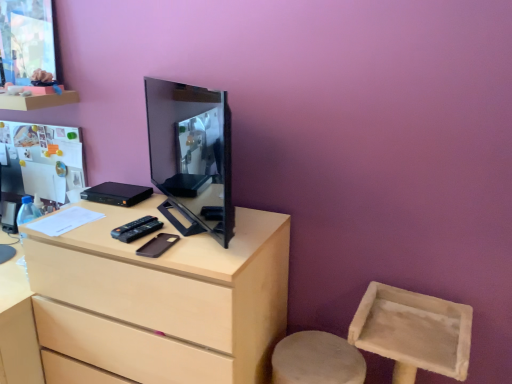
Find the location of `light wood chest of drawers at center`. light wood chest of drawers at center is located at coordinates [161, 300].

The height and width of the screenshot is (384, 512). In order to click on light wood chest of drawers at center in this screenshot , I will do `click(161, 300)`.

From the image's perspective, is matte wood shelf at upper left under light wood chest of drawers at center?

No.

Considering the relative sizes of matte wood shelf at upper left and light wood chest of drawers at center in the image provided, is matte wood shelf at upper left wider than light wood chest of drawers at center?

No.

Measure the distance between matte wood shelf at upper left and light wood chest of drawers at center.

matte wood shelf at upper left is 38.60 inches from light wood chest of drawers at center.

Can you confirm if matte wood shelf at upper left is positioned to the left of light wood chest of drawers at center?

Yes.

Is point (233, 318) behind point (8, 104)?

No, it is in front of (8, 104).

Considering the positions of objects light wood chest of drawers at center and matte wood shelf at upper left in the image provided, who is more to the left, light wood chest of drawers at center or matte wood shelf at upper left?

matte wood shelf at upper left is more to the left.

The height and width of the screenshot is (384, 512). In order to click on the chest of drawers that appears in front of the matte wood shelf at upper left in this screenshot , I will do `click(161, 300)`.

Does light wood chest of drawers at center have a greater width compared to matte wood shelf at upper left?

Correct, the width of light wood chest of drawers at center exceeds that of matte wood shelf at upper left.

Is matte wood shelf at upper left surrounded by black glossy monitor at center?

That's incorrect, matte wood shelf at upper left is not inside black glossy monitor at center.

Which is nearer, (188, 121) or (38, 105)?

The point (188, 121) is in front.

Does black glossy monitor at center have a larger size compared to matte wood shelf at upper left?

Yes, black glossy monitor at center is bigger than matte wood shelf at upper left.

Is black glossy monitor at center in front of or behind matte wood shelf at upper left in the image?

black glossy monitor at center is in front of matte wood shelf at upper left.

The image size is (512, 384). Find the location of `chest of drawers on the left of black glossy monitor at center`. chest of drawers on the left of black glossy monitor at center is located at coordinates (161, 300).

From a real-world perspective, is light wood chest of drawers at center above or below black glossy monitor at center?

Clearly, from a real-world perspective, light wood chest of drawers at center is below black glossy monitor at center.

Does light wood chest of drawers at center have a larger size compared to black glossy monitor at center?

Correct, light wood chest of drawers at center is larger in size than black glossy monitor at center.

Is black glossy monitor at center at the back of light wood chest of drawers at center?

That's not correct — light wood chest of drawers at center is not looking away from black glossy monitor at center.

Does point (46, 104) come farther from viewer compared to point (198, 217)?

Yes.

Is black glossy monitor at center surrounded by matte wood shelf at upper left?

Actually, black glossy monitor at center is outside matte wood shelf at upper left.

From the picture: Can you tell me how much matte wood shelf at upper left and black glossy monitor at center differ in facing direction?

The facing directions of matte wood shelf at upper left and black glossy monitor at center are 38.4 degrees apart.

Measure the distance between matte wood shelf at upper left and black glossy monitor at center.

matte wood shelf at upper left is 23.17 inches away from black glossy monitor at center.

Consider the image. Is black glossy monitor at center not near light wood chest of drawers at center?

No, black glossy monitor at center is in close proximity to light wood chest of drawers at center.

Which of these two, black glossy monitor at center or light wood chest of drawers at center, is smaller?

With smaller size is black glossy monitor at center.

Is black glossy monitor at center not inside light wood chest of drawers at center?

Yes, black glossy monitor at center is not within light wood chest of drawers at center.

Consider the image. From a real-world perspective, which object rests below the other?

In real-world perspective, light wood chest of drawers at center is lower.

In the image, there is a light wood chest of drawers at center. Identify the location of shelf above it (from the image's perspective). (38, 101).

The image size is (512, 384). Find the location of `shelf behind the light wood chest of drawers at center`. shelf behind the light wood chest of drawers at center is located at coordinates tap(38, 101).

When comparing their distances from black glossy monitor at center, does matte wood shelf at upper left or light wood chest of drawers at center seem closer?

The object closer to black glossy monitor at center is light wood chest of drawers at center.

Estimate the real-world distances between objects in this image. Which object is closer to matte wood shelf at upper left, light wood chest of drawers at center or black glossy monitor at center?

black glossy monitor at center lies closer to matte wood shelf at upper left than the other object.

Based on their spatial positions, is matte wood shelf at upper left or black glossy monitor at center further from light wood chest of drawers at center?

Among the two, matte wood shelf at upper left is located further to light wood chest of drawers at center.

Based on their spatial positions, is black glossy monitor at center or light wood chest of drawers at center further from matte wood shelf at upper left?

light wood chest of drawers at center.

When comparing their distances from black glossy monitor at center, does light wood chest of drawers at center or matte wood shelf at upper left seem closer?

light wood chest of drawers at center.

When comparing their distances from light wood chest of drawers at center, does black glossy monitor at center or matte wood shelf at upper left seem closer?

black glossy monitor at center lies closer to light wood chest of drawers at center than the other object.

Image resolution: width=512 pixels, height=384 pixels. Find the location of `computer monitor between matte wood shelf at upper left and light wood chest of drawers at center in the vertical direction`. computer monitor between matte wood shelf at upper left and light wood chest of drawers at center in the vertical direction is located at coordinates (192, 153).